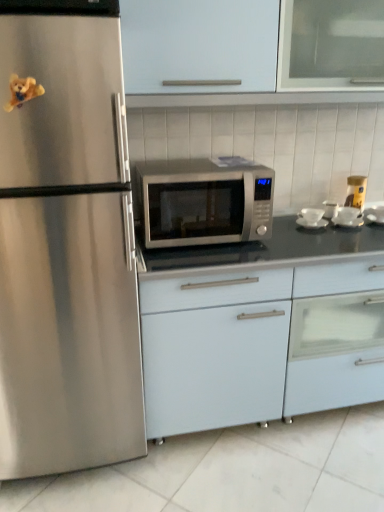
Question: From the image's perspective, does yellow matte jar at upper right, arranged as the third appliance when viewed from the left, appear higher than white glossy cabinet at upper center, acting as the 2th cabinetry starting from the bottom?

Choices:
 (A) yes
 (B) no

Answer: (B)

Question: Is yellow matte jar at upper right, the first appliance in the right-to-left sequence, taller than white glossy cabinet at upper center, which ranks as the 1th cabinetry in top-to-bottom order?

Choices:
 (A) yes
 (B) no

Answer: (B)

Question: Is yellow matte jar at upper right, arranged as the third appliance when viewed from the left, oriented towards white glossy cabinet at upper center, acting as the 2th cabinetry starting from the bottom?

Choices:
 (A) no
 (B) yes

Answer: (A)

Question: Is the surface of yellow matte jar at upper right, arranged as the third appliance when viewed from the left, in direct contact with white glossy cabinet at upper center, acting as the 2th cabinetry starting from the bottom?

Choices:
 (A) yes
 (B) no

Answer: (B)

Question: From a real-world perspective, is yellow matte jar at upper right, arranged as the third appliance when viewed from the left, below white glossy cabinet at upper center, which ranks as the 1th cabinetry in top-to-bottom order?

Choices:
 (A) no
 (B) yes

Answer: (B)

Question: In terms of size, does yellow matte jar at upper right, the first appliance in the right-to-left sequence, appear bigger or smaller than satin silver microwave at center?

Choices:
 (A) small
 (B) big

Answer: (A)

Question: From a real-world perspective, is yellow matte jar at upper right, arranged as the third appliance when viewed from the left, physically located above or below satin silver microwave at center?

Choices:
 (A) above
 (B) below

Answer: (B)

Question: Would you say yellow matte jar at upper right, arranged as the third appliance when viewed from the left, is inside or outside satin silver microwave at center?

Choices:
 (A) inside
 (B) outside

Answer: (B)

Question: In the image, is yellow matte jar at upper right, the first appliance in the right-to-left sequence, positioned in front of or behind satin silver microwave at center?

Choices:
 (A) behind
 (B) front

Answer: (A)

Question: From their relative heights in the image, would you say white glossy tile at lower center is taller or shorter than white matte cabinet at center, which is the 2th cabinetry from top to bottom?

Choices:
 (A) short
 (B) tall

Answer: (A)

Question: Considering the positions of point (87, 499) and point (266, 381), is point (87, 499) closer or farther from the camera than point (266, 381)?

Choices:
 (A) farther
 (B) closer

Answer: (B)

Question: Would you say white glossy tile at lower center is to the left or to the right of white matte cabinet at center, which is counted as the 1th cabinetry, starting from the bottom, in the picture?

Choices:
 (A) right
 (B) left

Answer: (B)

Question: Considering the positions of white glossy tile at lower center and white matte cabinet at center, which is counted as the 1th cabinetry, starting from the bottom, in the image, is white glossy tile at lower center wider or thinner than white matte cabinet at center, which is counted as the 1th cabinetry, starting from the bottom,?

Choices:
 (A) wide
 (B) thin

Answer: (A)

Question: Is satin silver microwave at center, the second appliance in the right-to-left sequence, taller or shorter than satin silver microwave at center?

Choices:
 (A) tall
 (B) short

Answer: (B)

Question: In the image, is satin silver microwave at center, placed as the 2th appliance when sorted from left to right, positioned in front of or behind satin silver microwave at center?

Choices:
 (A) front
 (B) behind

Answer: (B)